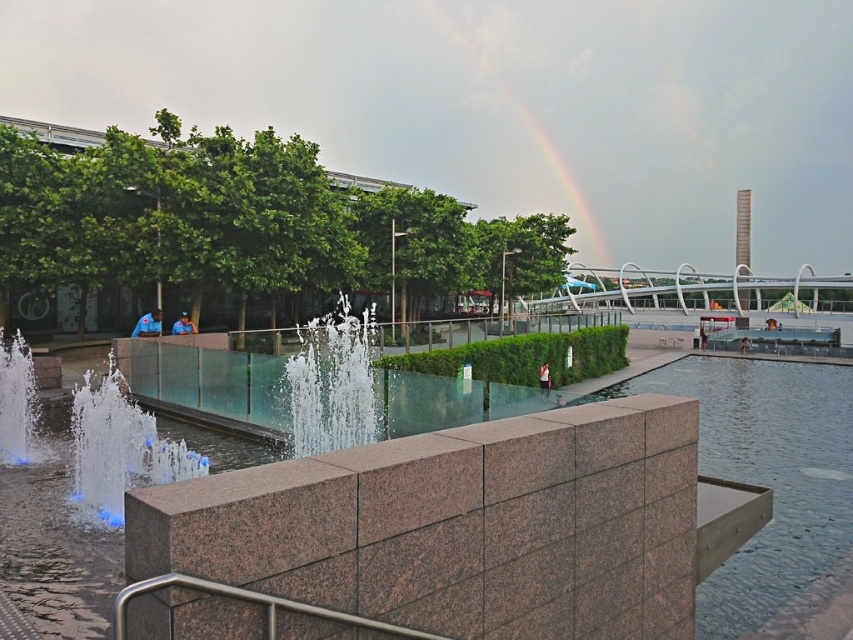
You are standing in the urban park and want to reach a specific point marked as point (x=83, y=452). Considering the water feature and stone wall in your path, can you estimate how far you need to walk to reach that point?

The distance between point (x=83, y=452) and the viewer is 8.84 meters, so you need to walk approximately 8.84 meters to reach that point.

Based on the photo, you are a photographer trying to capture the rainbow in the sky. You notice the clear glass water at center and the clear water fountain at center. Which object should you focus on to ensure the rainbow is reflected properly?

The clear glass water at center is not as tall as the clear water fountain at center, so focusing on the clear glass water at center will allow the rainbow to be reflected properly as it is lower and closer to the water surface.